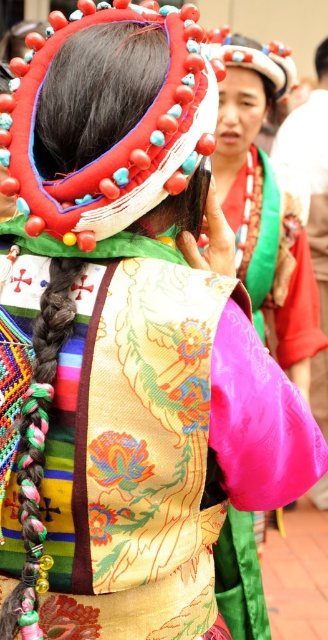
Measure the distance between silky pink fabric at center and matte black hair at upper center.

silky pink fabric at center and matte black hair at upper center are 3.22 meters apart from each other.

Does silky pink fabric at center have a greater width compared to matte black hair at upper center?

Correct, the width of silky pink fabric at center exceeds that of matte black hair at upper center.

Is point (240, 544) positioned after point (318, 48)?

No, it is not.

You are a GUI agent. You are given a task and a screenshot of the screen. Output one action in this format:
    pyautogui.click(x=<x>, y=<y>)
    Task: Click on the silky pink fabric at center
    The width and height of the screenshot is (328, 640).
    Given the screenshot: What is the action you would take?
    pyautogui.click(x=264, y=202)

Which is more to the left, matte red headdress at center or matte black hair at upper center?

From the viewer's perspective, matte red headdress at center appears more on the left side.

Based on the photo, is the position of matte red headdress at center less distant than that of matte black hair at upper center?

Yes.

The height and width of the screenshot is (640, 328). Describe the element at coordinates (258, 67) in the screenshot. I see `matte red headdress at center` at that location.

This screenshot has height=640, width=328. I want to click on matte red headdress at center, so click(x=258, y=67).

Can you confirm if silky pink fabric at center is shorter than matte red headdress at center?

In fact, silky pink fabric at center may be taller than matte red headdress at center.

How distant is silky pink fabric at center from matte red headdress at center?

silky pink fabric at center is 15.44 inches away from matte red headdress at center.

Which is behind, point (282, 326) or point (219, 49)?

The point (282, 326) is behind.

The image size is (328, 640). I want to click on silky pink fabric at center, so click(264, 202).